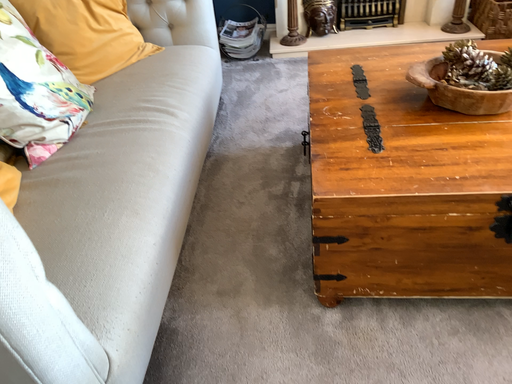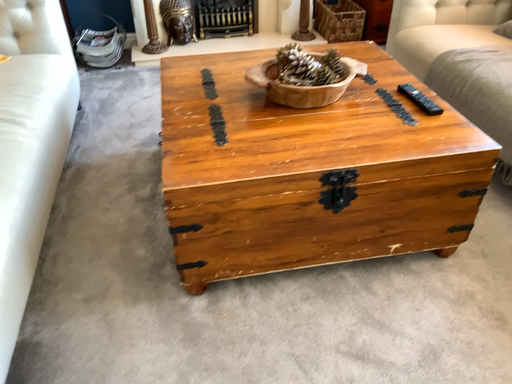
Question: How did the camera likely rotate when shooting the video?

Choices:
 (A) rotated right
 (B) rotated left

Answer: (A)